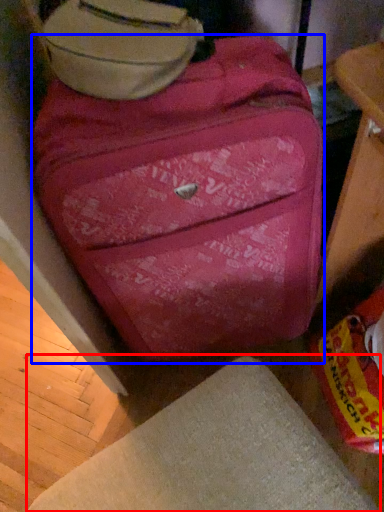
Question: Which point is closer to the camera, furniture (highlighted by a red box) or suitcase (highlighted by a blue box)?

Choices:
 (A) furniture
 (B) suitcase

Answer: (A)